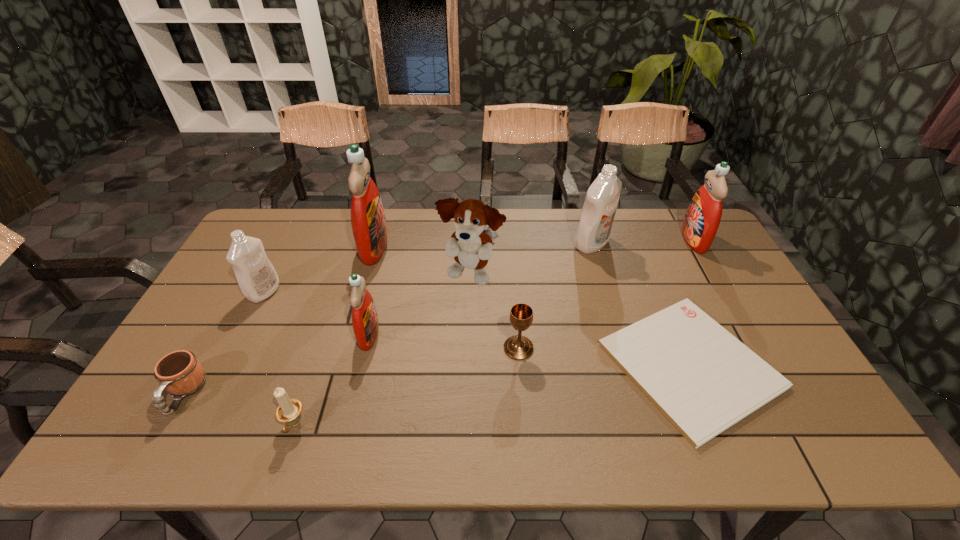
Select which object is the second closest to the fourth detergent from left to right. Please provide its 2D coordinates. Your answer should be formatted as a tuple, i.e. [(x, y)], where the tuple contains the x and y coordinates of a point satisfying the conditions above.

[(471, 245)]

Locate which detergent is the closest to the bigger white detergent. Please provide its 2D coordinates. Your answer should be formatted as a tuple, i.e. [(x, y)], where the tuple contains the x and y coordinates of a point satisfying the conditions above.

[(703, 216)]

Identify which detergent is located as the fourth nearest to the second shortest object. Please provide its 2D coordinates. Your answer should be formatted as a tuple, i.e. [(x, y)], where the tuple contains the x and y coordinates of a point satisfying the conditions above.

[(601, 202)]

In order to click on red detergent that is the second closest to the mug in this screenshot , I will do `click(369, 227)`.

Identify the location of the second closest red detergent to the chalice. The image size is (960, 540). (369, 227).

This screenshot has width=960, height=540. What are the coordinates of `blank space that satisfies the following two spatial constraints: 1. on the front surface of the chalice; 2. on the right side of the nearest red detergent` in the screenshot? It's located at (366, 348).

At what (x,y) coordinates should I click in order to perform the action: click on free space that satisfies the following two spatial constraints: 1. on the front surface of the second biggest red detergent; 2. on the handle side of the candle_holder. Please return your answer as a coordinate pair (x, y). The image size is (960, 540). Looking at the image, I should click on [x=799, y=425].

The width and height of the screenshot is (960, 540). Find the location of `vacant position in the image that satisfies the following two spatial constraints: 1. on the face of the chalice; 2. on the right side of the brown puppy`. vacant position in the image that satisfies the following two spatial constraints: 1. on the face of the chalice; 2. on the right side of the brown puppy is located at coordinates (469, 348).